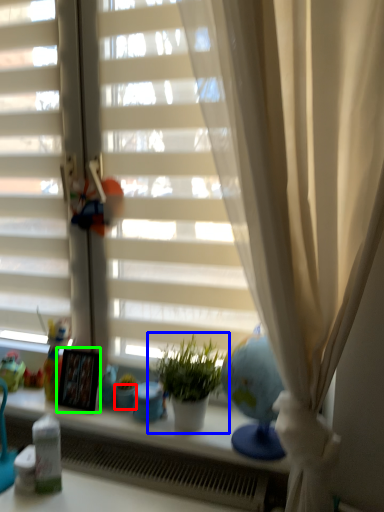
Question: Considering the real-world distances, which object is closest to glass vase (highlighted by a red box)? houseplant (highlighted by a blue box) or picture frame (highlighted by a green box).

Choices:
 (A) houseplant
 (B) picture frame

Answer: (B)